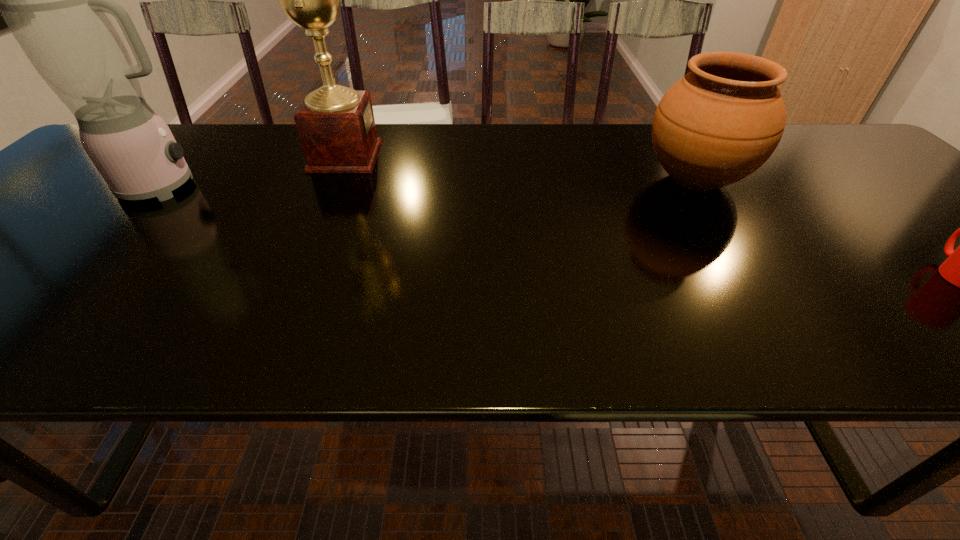
Identify the location of vacant area at the far edge of the desktop. (567, 160).

Where is `vacant space at the near edge`? vacant space at the near edge is located at coordinates (184, 330).

In the image, there is a desktop. Where is `vacant space at the left edge`? This screenshot has height=540, width=960. vacant space at the left edge is located at coordinates (52, 231).

Find the location of a particular element. vacant space at the right edge of the desktop is located at coordinates point(869,213).

In the image, there is a desktop. At what (x,y) coordinates should I click in order to perform the action: click on vacant space at the far right corner. Please return your answer as a coordinate pair (x, y). This screenshot has width=960, height=540. Looking at the image, I should click on (790, 132).

You are a GUI agent. You are given a task and a screenshot of the screen. Output one action in this format:
    pyautogui.click(x=<x>, y=<y>)
    Task: Click on the empty space between the second object from right to left and the leftmost object
    The height and width of the screenshot is (540, 960).
    Given the screenshot: What is the action you would take?
    pyautogui.click(x=430, y=184)

The width and height of the screenshot is (960, 540). Find the location of `vacant area between the leftmost object and the second shortest object`. vacant area between the leftmost object and the second shortest object is located at coordinates (430, 184).

You are a GUI agent. You are given a task and a screenshot of the screen. Output one action in this format:
    pyautogui.click(x=<x>, y=<y>)
    Task: Click on the free space between the third object from left to right and the second object from left to right
    The width and height of the screenshot is (960, 540).
    Given the screenshot: What is the action you would take?
    pyautogui.click(x=520, y=168)

I want to click on free space between the pottery and the third object from right to left, so click(x=520, y=168).

At what (x,y) coordinates should I click in order to perform the action: click on vacant area that lies between the second shortest object and the leftmost object. Please return your answer as a coordinate pair (x, y). The image size is (960, 540). Looking at the image, I should click on (430, 184).